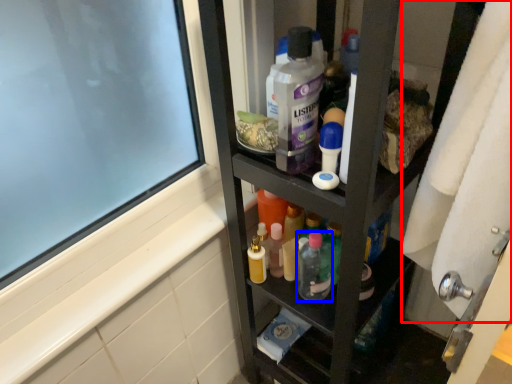
Question: Which object appears farthest to the camera in this image, bath towel (highlighted by a red box) or toiletry (highlighted by a blue box)?

Choices:
 (A) bath towel
 (B) toiletry

Answer: (B)